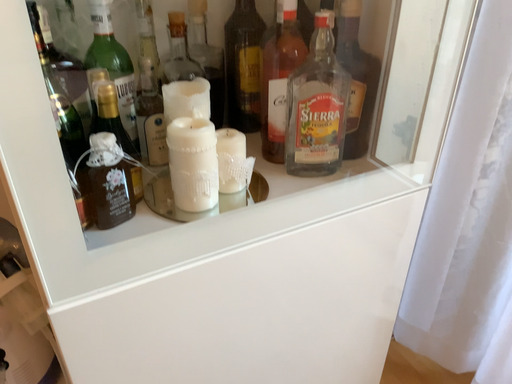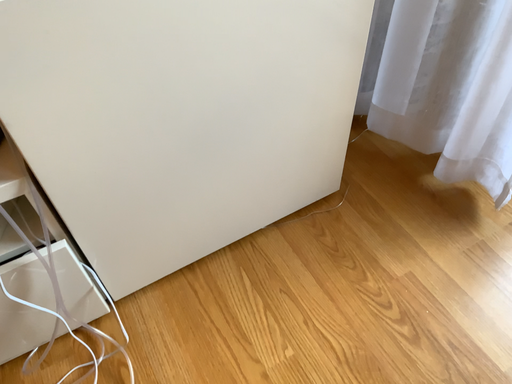
Question: How did the camera likely rotate when shooting the video?

Choices:
 (A) rotated downward
 (B) rotated upward

Answer: (A)